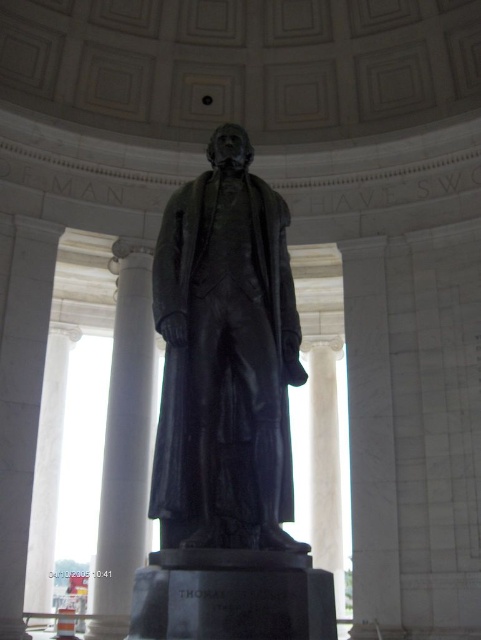
Question: Is black polished statue at center above white marble column at center?

Choices:
 (A) yes
 (B) no

Answer: (A)

Question: Which point is farther to the camera?

Choices:
 (A) white marble column at center
 (B) black polished statue at center

Answer: (A)

Question: Which of the following is the farthest from the observer?

Choices:
 (A) (262, 516)
 (B) (123, 620)

Answer: (B)

Question: Is black polished statue at center behind white marble column at center?

Choices:
 (A) no
 (B) yes

Answer: (A)

Question: Which point is farther to the camera?

Choices:
 (A) (108, 497)
 (B) (275, 403)

Answer: (A)

Question: Is black polished statue at center below white marble column at center?

Choices:
 (A) no
 (B) yes

Answer: (A)